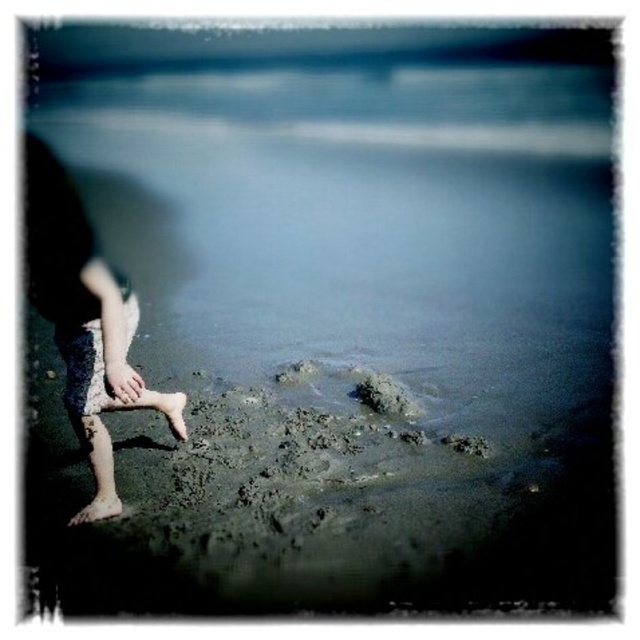
Who is more distant from viewer, (x=180, y=417) or (x=106, y=502)?

The point (x=180, y=417) is behind.

Identify the location of barefoot sand at lower left. (172, 412).

Is dark skin legs at left to the left of brown sand at lower left from the viewer's perspective?

In fact, dark skin legs at left is to the right of brown sand at lower left.

Measure the distance between dark skin legs at left and brown sand at lower left.

dark skin legs at left and brown sand at lower left are 28.80 inches apart.

Is point (51, 230) positioned before point (113, 493)?

That is True.

This screenshot has height=640, width=640. Find the location of `dark skin legs at left`. dark skin legs at left is located at coordinates (80, 307).

Can you confirm if dark skin legs at left is positioned above barefoot sand at lower left?

Indeed, dark skin legs at left is positioned over barefoot sand at lower left.

In the scene shown: Is dark skin legs at left smaller than barefoot sand at lower left?

Actually, dark skin legs at left might be larger than barefoot sand at lower left.

Between point (83, 268) and point (180, 403), which one is positioned in front?

Positioned in front is point (83, 268).

Locate an element on the screen. dark skin legs at left is located at coordinates (80, 307).